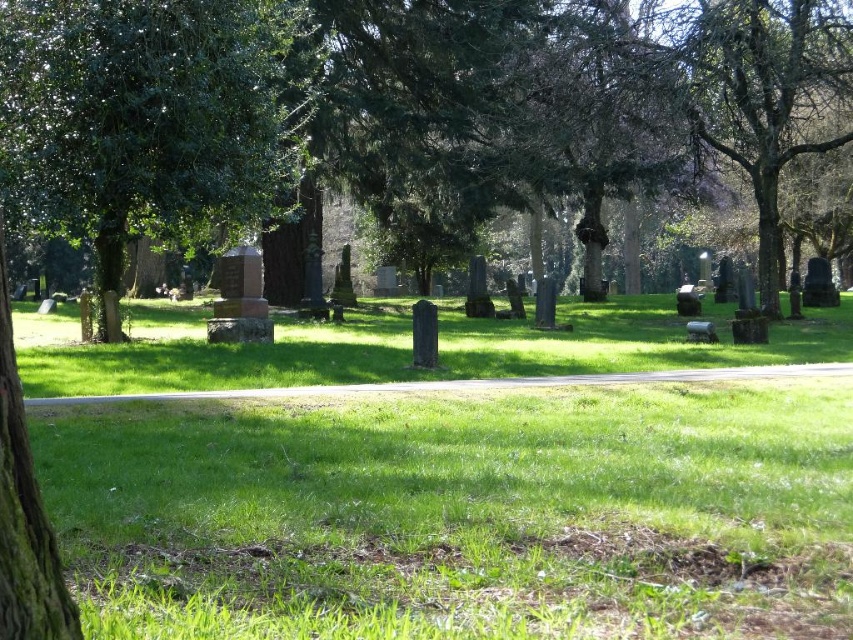
Is point (148, 72) farther from camera compared to point (26, 93)?

No, (148, 72) is closer to viewer.

Can you confirm if green leafy tree at center is thinner than green leafy tree at left?

No.

This screenshot has width=853, height=640. Identify the location of green leafy tree at center. (384, 104).

The image size is (853, 640). I want to click on green leafy tree at center, so click(x=384, y=104).